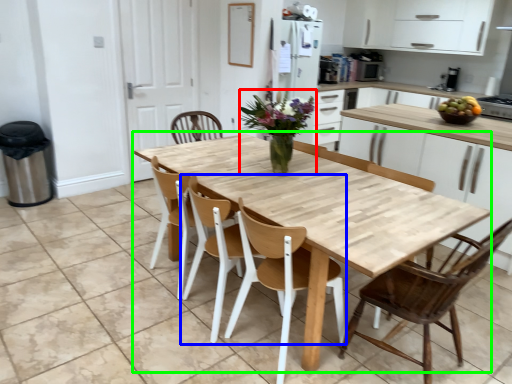
Question: Considering the real-world distances, which object is closest to floral arrangement (highlighted by a red box)? chair (highlighted by a blue box) or kitchen & dining room table (highlighted by a green box).

Choices:
 (A) chair
 (B) kitchen & dining room table

Answer: (B)